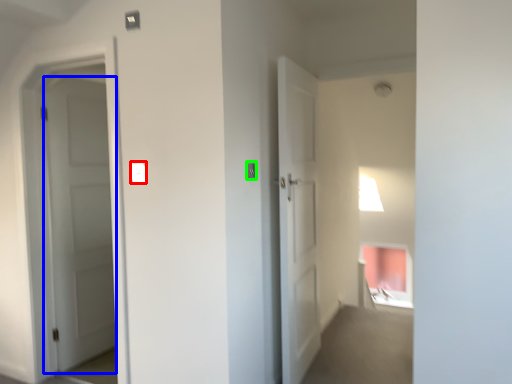
Question: Which object is the closest to the light switch (highlighted by a red box)? Choose among these: door (highlighted by a blue box) or light switch (highlighted by a green box).

Choices:
 (A) door
 (B) light switch

Answer: (B)